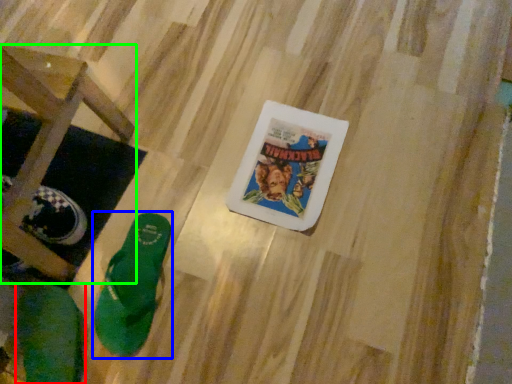
Question: Which object is the closest to the footwear (highlighted by a red box)? Choose among these: footwear (highlighted by a blue box) or furniture (highlighted by a green box).

Choices:
 (A) footwear
 (B) furniture

Answer: (A)